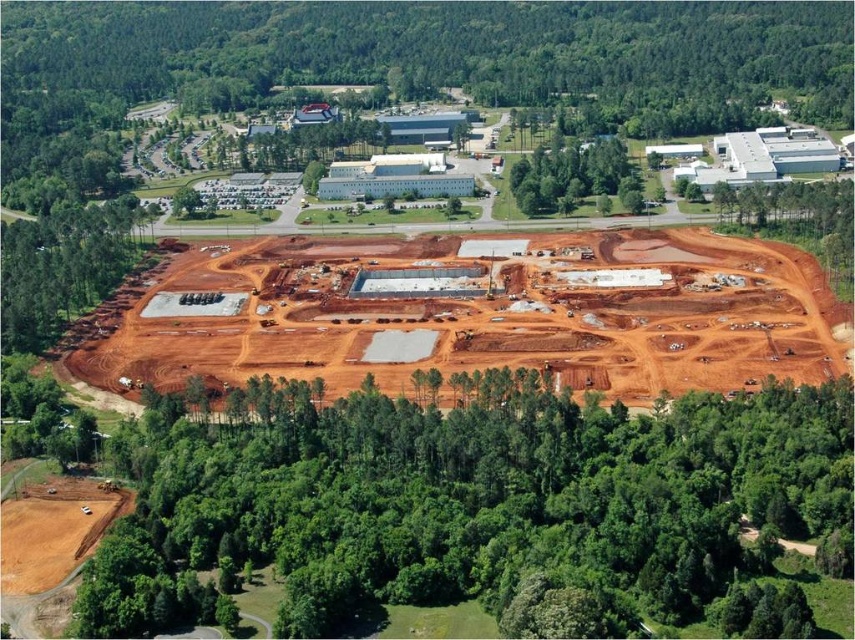
Based on the provided scene, where are the green leafy trees at lower center located in terms of coordinates?

The green leafy trees at lower center are located at coordinates point (475, 509).

You are a drone operator tasked with capturing aerial footage of the construction site. You notice two green leafy trees in the image. Which tree, the green leafy trees at lower center or the green leafy tree at upper center, would appear closer to the camera based on their height?

The green leafy trees at lower center is shorter than the green leafy tree at upper center. Since the shorter tree is at the lower center, it is likely closer to the camera, making it appear smaller due to perspective.